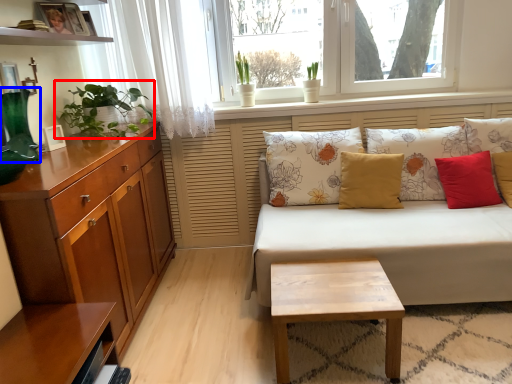
Question: Which point is closer to the camera, houseplant (highlighted by a red box) or vase (highlighted by a blue box)?

Choices:
 (A) houseplant
 (B) vase

Answer: (B)